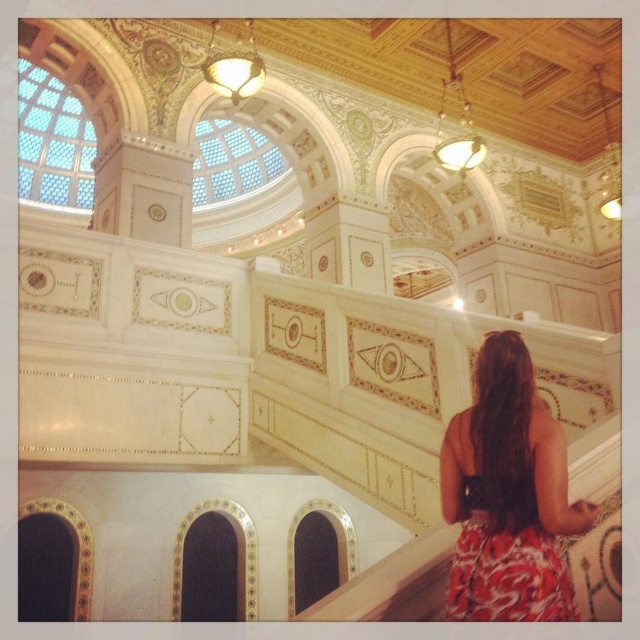
Question: In this image, where is red floral dress at lower right located relative to printed fabric dress at lower right?

Choices:
 (A) right
 (B) left

Answer: (A)

Question: Which point is closer to the camera?

Choices:
 (A) printed fabric dress at lower right
 (B) red floral dress at lower right

Answer: (A)

Question: Can you confirm if red floral dress at lower right is thinner than printed fabric dress at lower right?

Choices:
 (A) no
 (B) yes

Answer: (A)

Question: Observing the image, what is the correct spatial positioning of red floral dress at lower right in reference to printed fabric dress at lower right?

Choices:
 (A) below
 (B) above

Answer: (B)

Question: Among these points, which one is farthest from the camera?

Choices:
 (A) (493, 540)
 (B) (504, 580)

Answer: (A)

Question: Which point is farther to the camera?

Choices:
 (A) (454, 492)
 (B) (540, 561)

Answer: (A)